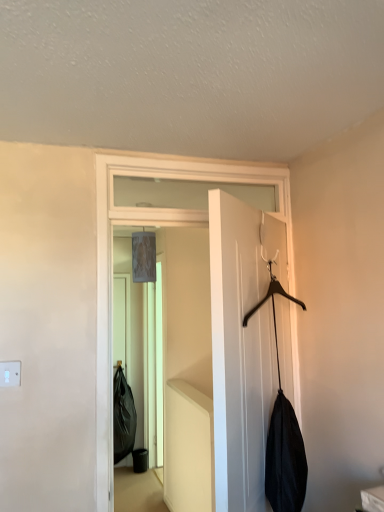
Question: Which direction should I rotate to look at white matte door at center, the first door in the back-to-front sequence, — up or down?

Choices:
 (A) down
 (B) up

Answer: (A)

Question: Is the position of white matte door at center, placed as the second door when sorted from back to front, less distant than that of white matte door at center, placed as the 2th door when sorted from front to back?

Choices:
 (A) yes
 (B) no

Answer: (A)

Question: From a real-world perspective, is white matte door at center, placed as the second door when sorted from back to front, positioned over white matte door at center, the first door in the back-to-front sequence, based on gravity?

Choices:
 (A) yes
 (B) no

Answer: (B)

Question: Is white matte door at center, placed as the second door when sorted from back to front, oriented away from white matte door at center, placed as the 2th door when sorted from front to back?

Choices:
 (A) yes
 (B) no

Answer: (A)

Question: From the image's perspective, is white matte door at center, which is the 1th door in front-to-back order, over white matte door at center, the first door in the back-to-front sequence?

Choices:
 (A) yes
 (B) no

Answer: (B)

Question: Is white matte door at center, placed as the second door when sorted from back to front, surrounding white matte door at center, the first door in the back-to-front sequence?

Choices:
 (A) no
 (B) yes

Answer: (A)

Question: Considering the relative sizes of white matte door at center, placed as the second door when sorted from back to front, and white matte door at center, the first door in the back-to-front sequence, in the image provided, is white matte door at center, placed as the second door when sorted from back to front, wider than white matte door at center, the first door in the back-to-front sequence,?

Choices:
 (A) no
 (B) yes

Answer: (B)

Question: Considering the relative positions of white matte door at center, placed as the 2th door when sorted from front to back, and white matte door at center, which is the 1th door in front-to-back order, in the image provided, is white matte door at center, placed as the 2th door when sorted from front to back, to the right of white matte door at center, which is the 1th door in front-to-back order, from the viewer's perspective?

Choices:
 (A) no
 (B) yes

Answer: (A)

Question: From the image's perspective, is white matte door at center, placed as the 2th door when sorted from front to back, below white matte door at center, which is the 1th door in front-to-back order?

Choices:
 (A) no
 (B) yes

Answer: (A)

Question: Does white matte door at center, placed as the 2th door when sorted from front to back, have a greater width compared to white matte door at center, which is the 1th door in front-to-back order?

Choices:
 (A) yes
 (B) no

Answer: (B)

Question: Is white matte door at center, placed as the 2th door when sorted from front to back, behind white matte door at center, which is the 1th door in front-to-back order?

Choices:
 (A) yes
 (B) no

Answer: (A)

Question: Does white matte door at center, placed as the 2th door when sorted from front to back, have a greater height compared to white matte door at center, placed as the second door when sorted from back to front?

Choices:
 (A) yes
 (B) no

Answer: (A)

Question: From a real-world perspective, is white matte door at center, placed as the 2th door when sorted from front to back, beneath white matte door at center, which is the 1th door in front-to-back order?

Choices:
 (A) yes
 (B) no

Answer: (B)

Question: Is white matte door at center, placed as the second door when sorted from back to front, taller or shorter than white matte door at center, placed as the 2th door when sorted from front to back?

Choices:
 (A) short
 (B) tall

Answer: (A)